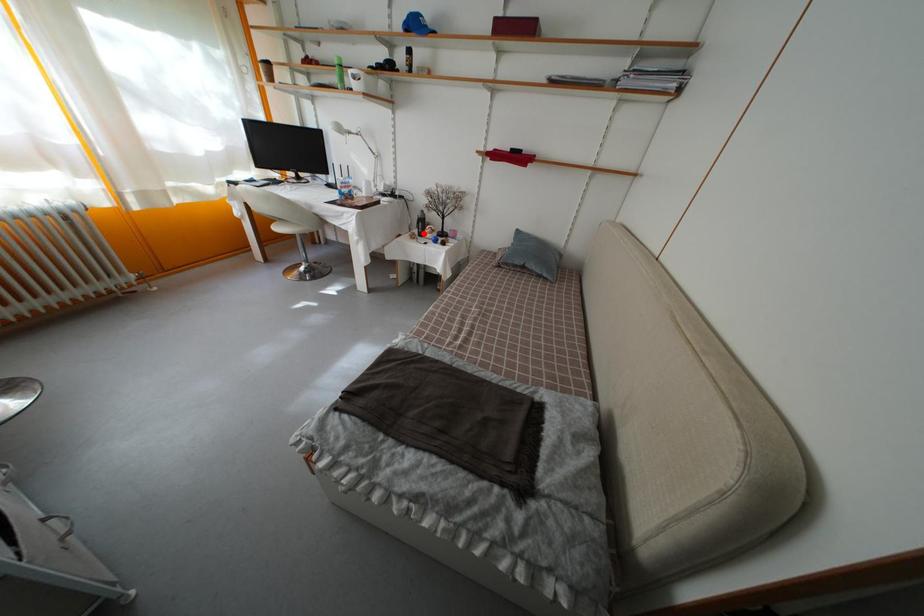
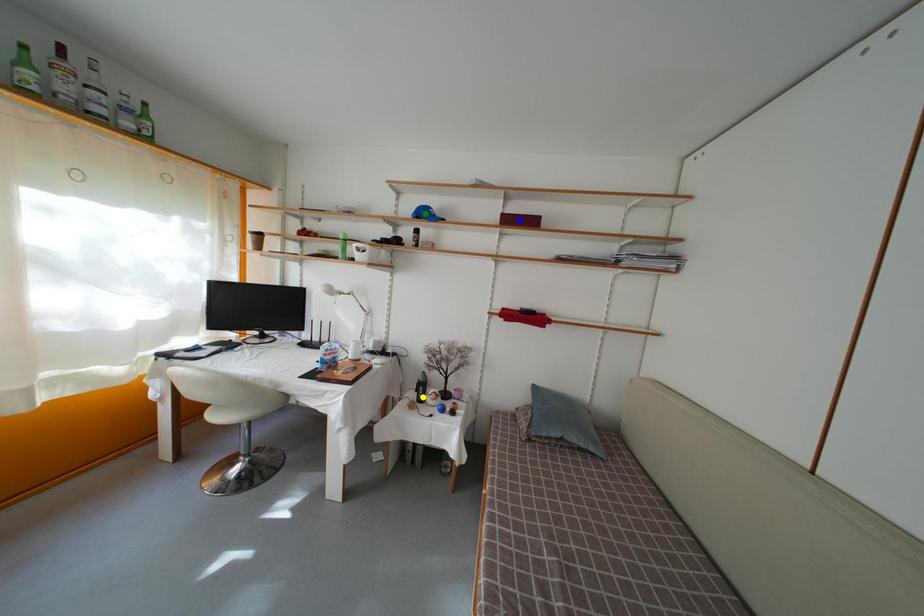
Question: I am providing you with two images of the same scene from different viewpoints. A red point is marked on the first image. You are given multiple points on the second image. Which mark in image 2 goes with the point in image 1?

Choices:
 (A) blue point
 (B) green point
 (C) yellow point

Answer: (C)